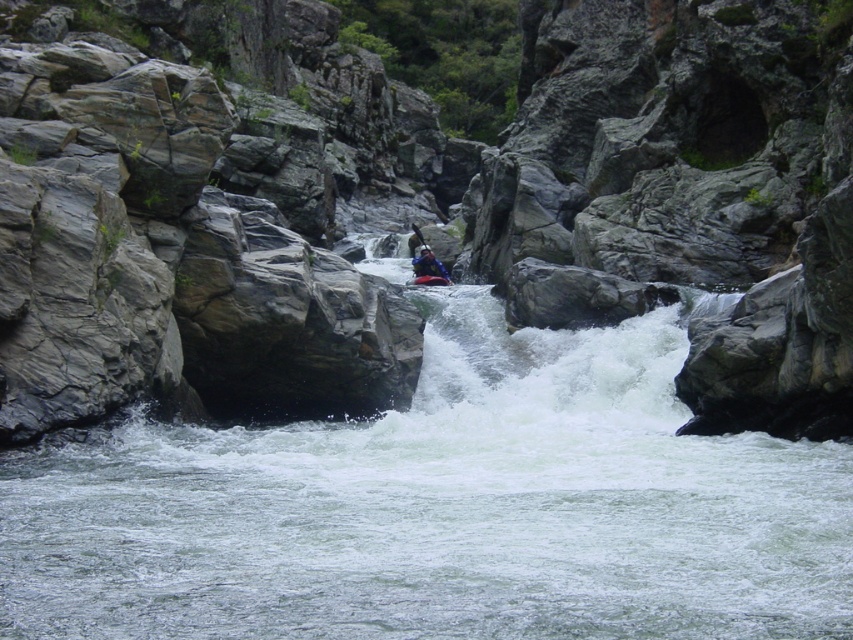
Question: Does white frothy water at center come in front of red plastic canoe at center?

Choices:
 (A) no
 (B) yes

Answer: (B)

Question: Is blue fabric raft at center above dark blue plastic paddle at center?

Choices:
 (A) yes
 (B) no

Answer: (B)

Question: Which point is farther to the camera?

Choices:
 (A) gray rock formation at center
 (B) red plastic canoe at center
 (C) dark blue plastic paddle at center

Answer: (C)

Question: Is blue fabric raft at center positioned at the back of dark blue plastic paddle at center?

Choices:
 (A) yes
 (B) no

Answer: (B)

Question: Which object appears farthest from the camera in this image?

Choices:
 (A) white frothy water at center
 (B) dark blue plastic paddle at center
 (C) red plastic canoe at center
 (D) blue fabric raft at center

Answer: (B)

Question: Which object appears farthest from the camera in this image?

Choices:
 (A) red plastic canoe at center
 (B) gray rock formation at center
 (C) white frothy water at center
 (D) blue fabric raft at center

Answer: (D)